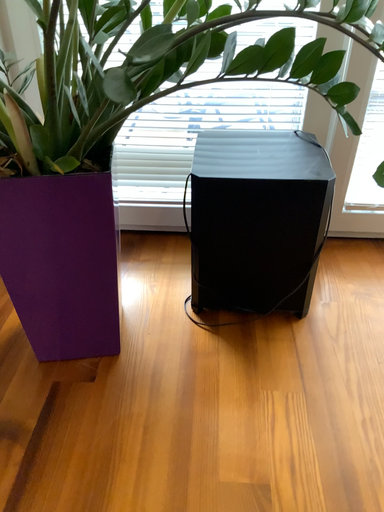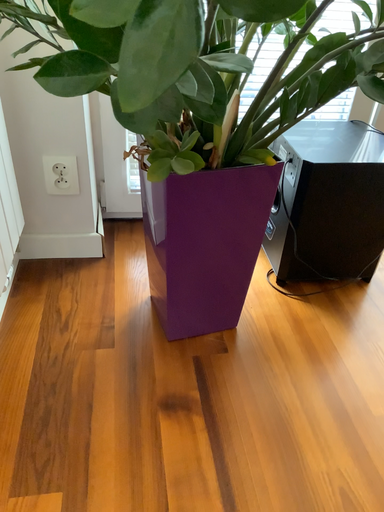
Question: Which way did the camera rotate in the video?

Choices:
 (A) rotated right
 (B) rotated left

Answer: (A)